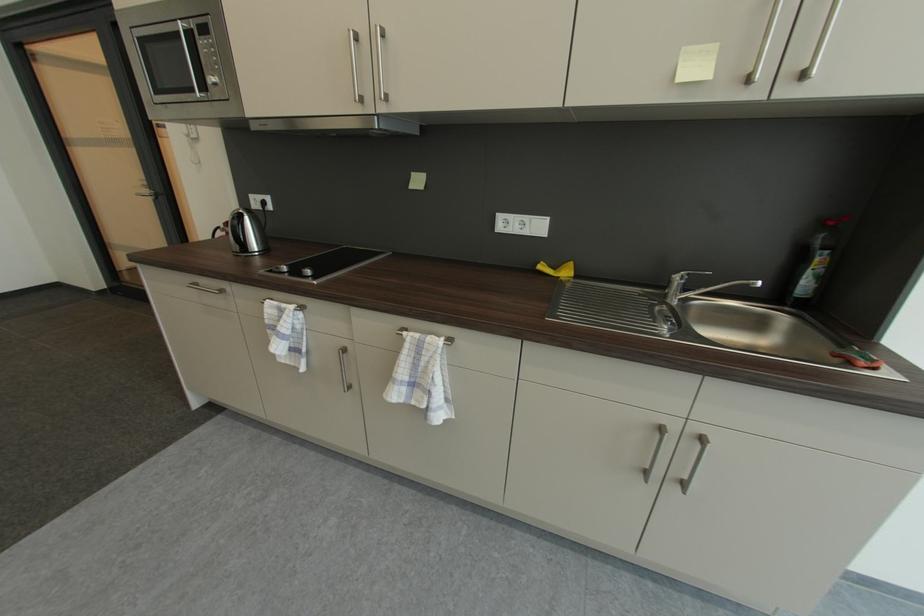
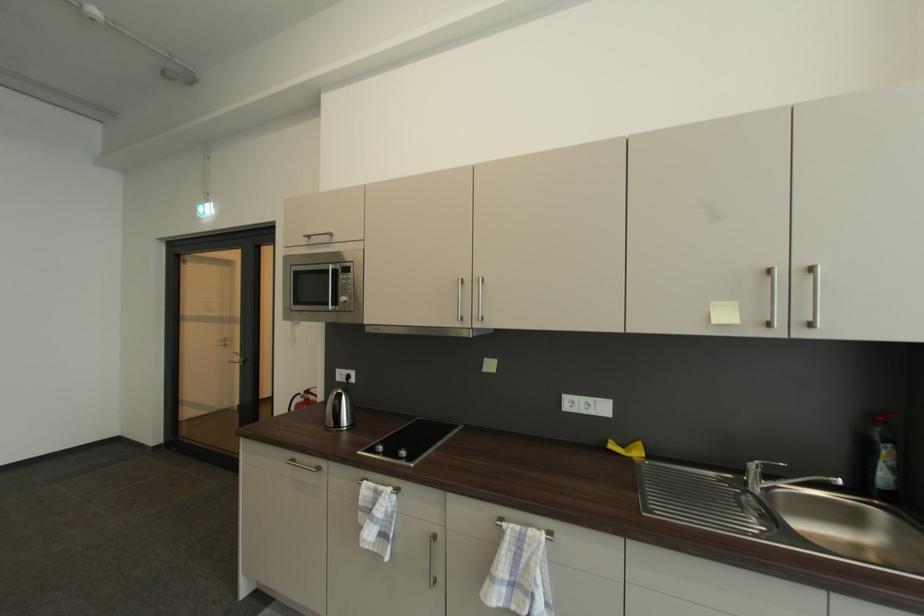
The point at (235, 225) is marked in the first image. Where is the corresponding point in the second image?

(314, 392)